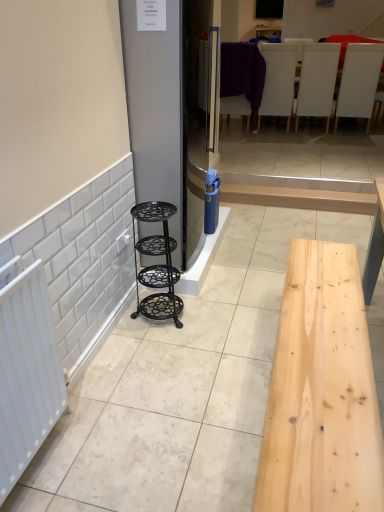
Where is `vacant area that is in front of black wrought iron shelf at center left, marked as the 1th furniture in a front-to-back arrangement`? Image resolution: width=384 pixels, height=512 pixels. vacant area that is in front of black wrought iron shelf at center left, marked as the 1th furniture in a front-to-back arrangement is located at coordinates (165, 343).